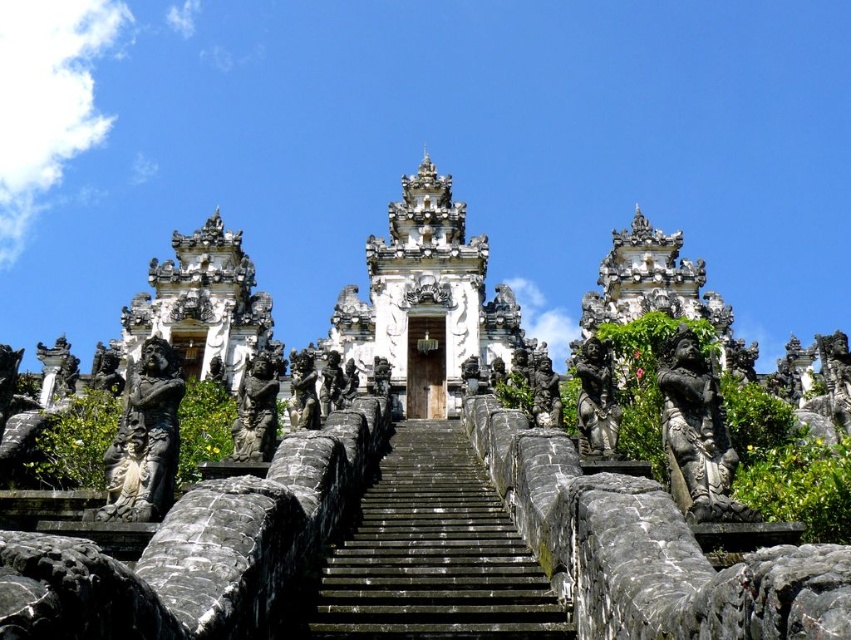
Does black stone stairs at center have a lesser width compared to white stone temple at center?

Indeed, black stone stairs at center has a lesser width compared to white stone temple at center.

Is point (447, 620) positioned in front of point (343, 337)?

Yes.

Locate an element on the screen. black stone stairs at center is located at coordinates (432, 554).